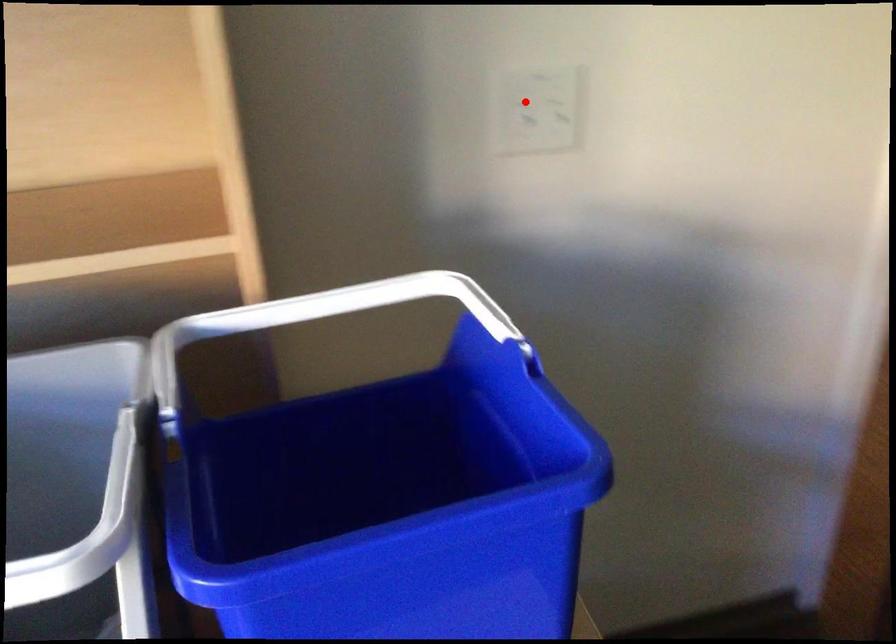
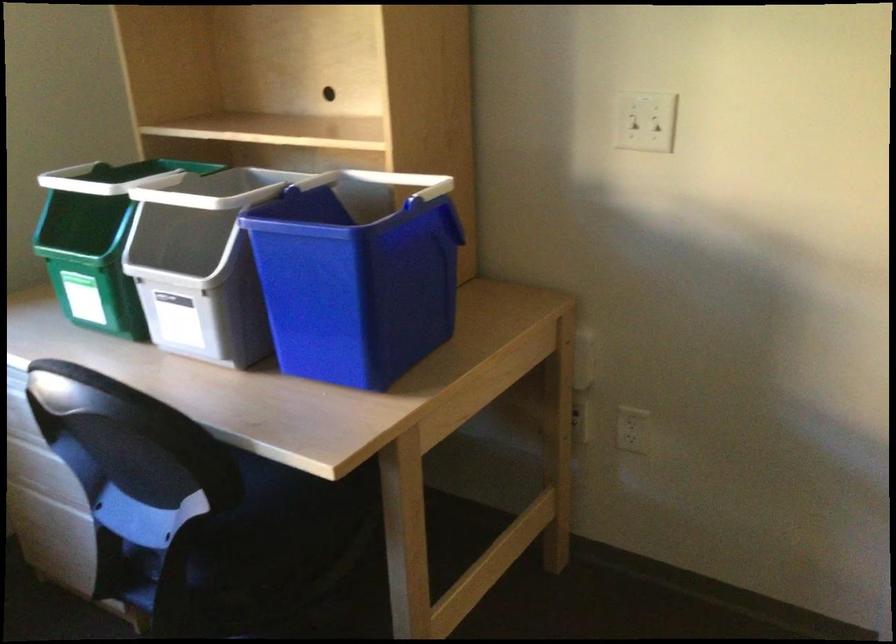
Find the pixel in the second image that matches the highlighted location in the first image.

(643, 118)